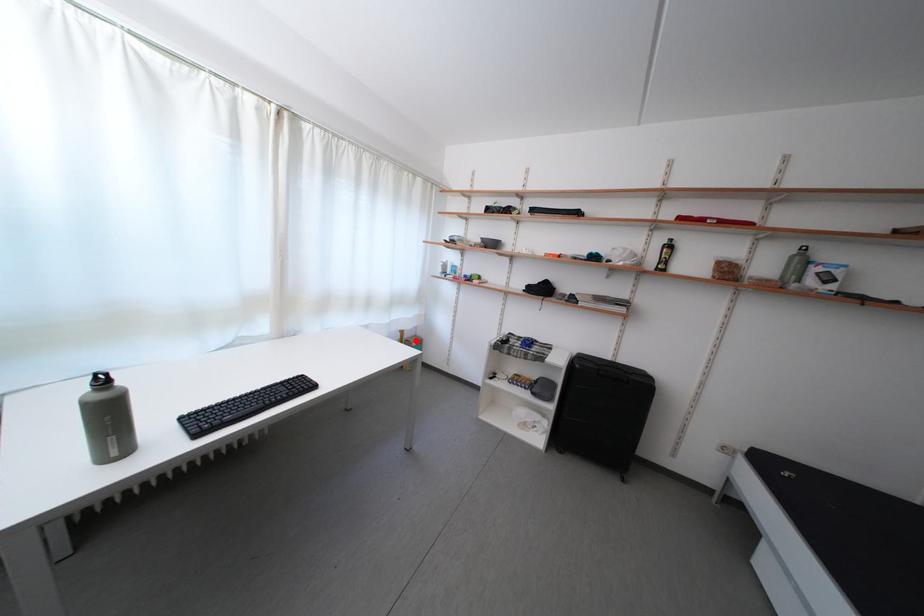
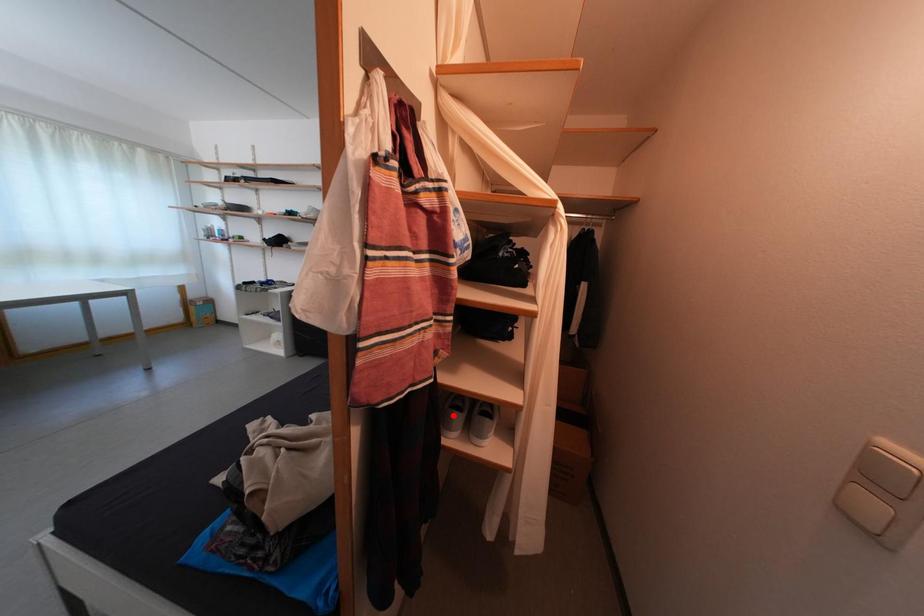
I am providing you with two images of the same scene from different viewpoints. A red point is marked on the first image and another point is marked on the second image. Are the points marked in image1 and image2 representing the same 3D position?

No